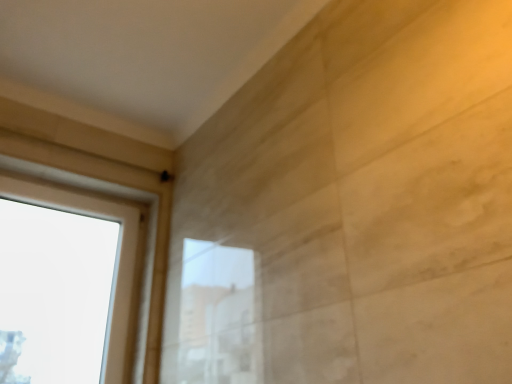
What is the approximate width of white plastic window at left?

white plastic window at left is 6.27 inches in width.

The width and height of the screenshot is (512, 384). Describe the element at coordinates (120, 251) in the screenshot. I see `white plastic window at left` at that location.

The width and height of the screenshot is (512, 384). I want to click on white plastic window at left, so click(120, 251).

Locate an element on the screen. This screenshot has width=512, height=384. white plastic window at left is located at coordinates (120, 251).